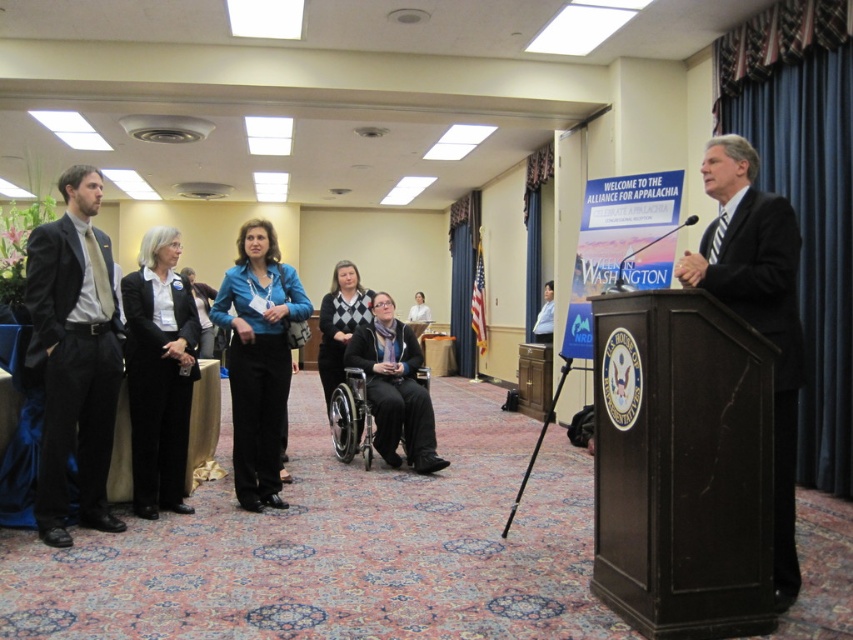
Between black fabric jacket at left and blue shirt at center, which one is positioned lower?

black fabric jacket at left

Can you confirm if black fabric jacket at left is positioned below blue shirt at center?

Yes, black fabric jacket at left is below blue shirt at center.

What do you see at coordinates (160, 372) in the screenshot?
I see `black fabric jacket at left` at bounding box center [160, 372].

Find the location of a particular element. The width and height of the screenshot is (853, 640). black fabric jacket at left is located at coordinates (160, 372).

Does black fabric jacket at left appear over metallic silver wheelchair at center?

Indeed, black fabric jacket at left is positioned over metallic silver wheelchair at center.

Who is positioned more to the right, black fabric jacket at left or metallic silver wheelchair at center?

Positioned to the right is metallic silver wheelchair at center.

Which is behind, point (151, 513) or point (367, 440)?

The point (367, 440) is behind.

The height and width of the screenshot is (640, 853). I want to click on black fabric jacket at left, so click(x=160, y=372).

Is matte black suit at left above blue shirt at center?

Actually, matte black suit at left is below blue shirt at center.

Between point (103, 291) and point (547, 336), which one is positioned behind?

The point (547, 336) is more distant.

Locate an element on the screen. This screenshot has width=853, height=640. matte black suit at left is located at coordinates [74, 355].